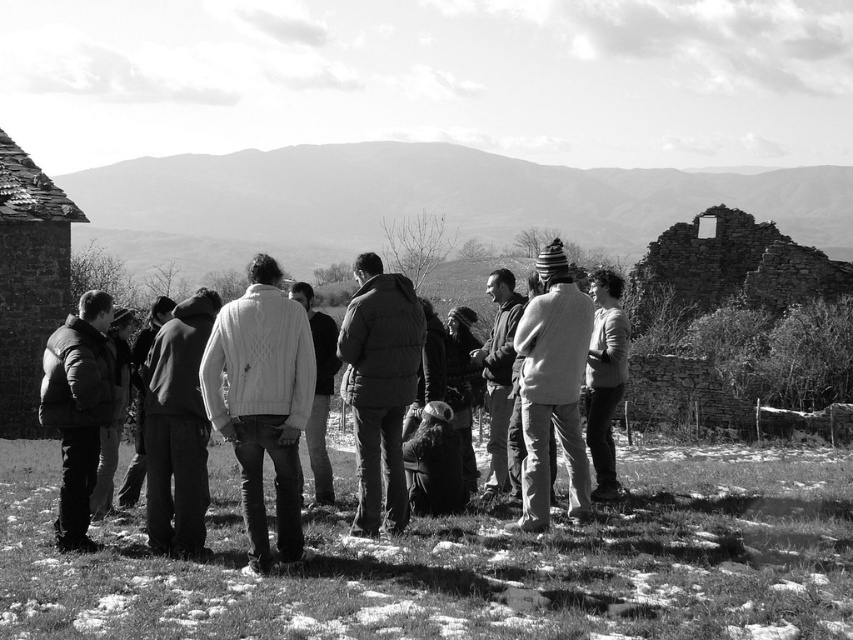
Does white knitted sweater at center appear under rustic stone hut at left?

Yes, white knitted sweater at center is below rustic stone hut at left.

Looking at this image, can you confirm if white knitted sweater at center is shorter than rustic stone hut at left?

Indeed, white knitted sweater at center has a lesser height compared to rustic stone hut at left.

Who is more forward, (207,392) or (28,259)?

Positioned in front is point (207,392).

At what (x,y) coordinates should I click in order to perform the action: click on white knitted sweater at center. Please return your answer as a coordinate pair (x, y). Looking at the image, I should click on (x=262, y=401).

Does puffy black jacket at center have a greater height compared to dark brown leather jacket at right?

Yes.

Is point (368, 317) positioned before point (614, 496)?

Yes, point (368, 317) is closer to viewer.

What do you see at coordinates (380, 385) in the screenshot? I see `puffy black jacket at center` at bounding box center [380, 385].

The width and height of the screenshot is (853, 640). Identify the location of puffy black jacket at center. (380, 385).

Is white knit sweater at center to the left of rustic stone hut at left from the viewer's perspective?

No, white knit sweater at center is not to the left of rustic stone hut at left.

Does white knit sweater at center have a larger size compared to rustic stone hut at left?

Indeed, white knit sweater at center has a larger size compared to rustic stone hut at left.

Identify the location of white knit sweater at center. This screenshot has height=640, width=853. (257, 403).

Find the location of a particular element. The height and width of the screenshot is (640, 853). white knit sweater at center is located at coordinates pos(257,403).